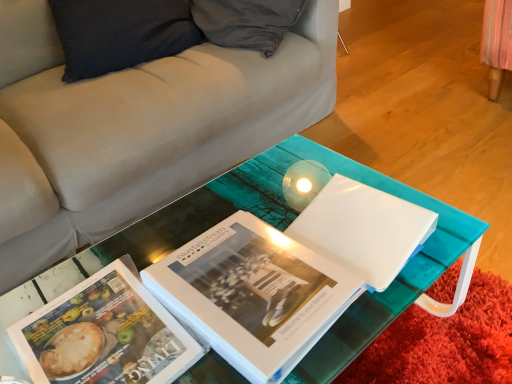
Question: Which direction should I rotate to look at white glossy book at center, arranged as the 1th book when viewed from the right?

Choices:
 (A) right
 (B) left

Answer: (B)

Question: From the image's perspective, is white glossy book at center, arranged as the 2th book when viewed from the left, on top of white glossy folder at center?

Choices:
 (A) yes
 (B) no

Answer: (B)

Question: Can we say white glossy book at center, arranged as the 2th book when viewed from the left, lies outside white glossy folder at center?

Choices:
 (A) no
 (B) yes

Answer: (B)

Question: Does white glossy book at center, arranged as the 1th book when viewed from the right, have a smaller size compared to white glossy folder at center?

Choices:
 (A) no
 (B) yes

Answer: (A)

Question: Does white glossy book at center, arranged as the 2th book when viewed from the left, have a greater width compared to white glossy folder at center?

Choices:
 (A) yes
 (B) no

Answer: (A)

Question: From a real-world perspective, is white glossy book at center, arranged as the 1th book when viewed from the right, beneath white glossy folder at center?

Choices:
 (A) no
 (B) yes

Answer: (B)

Question: From a real-world perspective, does white glossy book at center, arranged as the 1th book when viewed from the right, stand above white glossy folder at center?

Choices:
 (A) yes
 (B) no

Answer: (B)

Question: Considering the relative sizes of white glossy folder at center and matte paper book at center, which is the 1th book from left to right, in the image provided, is white glossy folder at center bigger than matte paper book at center, which is the 1th book from left to right,?

Choices:
 (A) yes
 (B) no

Answer: (A)

Question: From a real-world perspective, is white glossy folder at center located higher than matte paper book at center, which is counted as the 2th book, starting from the right?

Choices:
 (A) yes
 (B) no

Answer: (A)

Question: From the image's perspective, is white glossy folder at center on top of matte paper book at center, which is the 1th book from left to right?

Choices:
 (A) yes
 (B) no

Answer: (A)

Question: Is white glossy folder at center closer to camera compared to matte paper book at center, which is counted as the 2th book, starting from the right?

Choices:
 (A) yes
 (B) no

Answer: (B)

Question: Are white glossy folder at center and matte paper book at center, which is the 1th book from left to right, located far from each other?

Choices:
 (A) no
 (B) yes

Answer: (A)

Question: From a real-world perspective, is white glossy folder at center located beneath matte paper book at center, which is counted as the 2th book, starting from the right?

Choices:
 (A) yes
 (B) no

Answer: (B)

Question: Can you confirm if matte paper book at center, which is the 1th book from left to right, is bigger than white glossy book at center, arranged as the 1th book when viewed from the right?

Choices:
 (A) no
 (B) yes

Answer: (A)